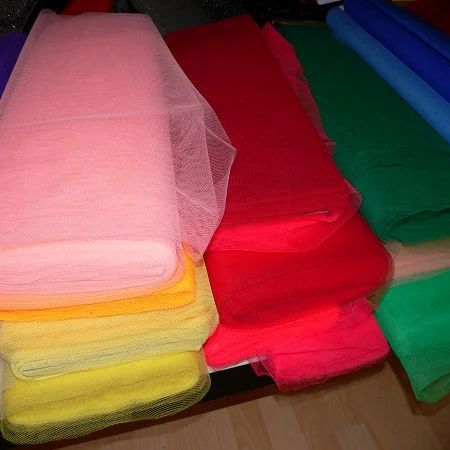
Where is `wooden table`? The width and height of the screenshot is (450, 450). wooden table is located at coordinates (219, 425), (360, 407).